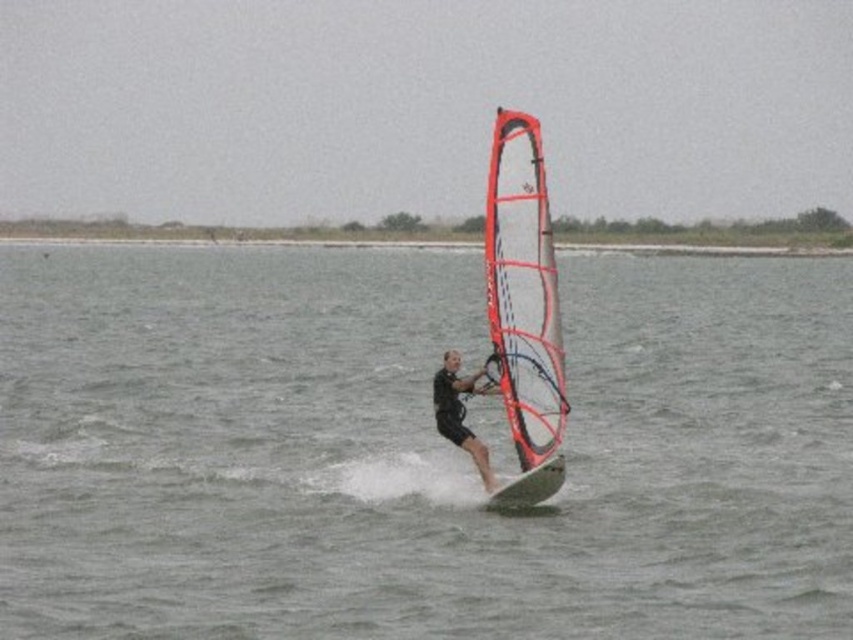
You are a photographer trying to capture the windsurfer. You notice the clear water at center and the transparent fabric sail at center in your viewfinder. Which object appears wider in the frame?

The clear water at center appears wider in the frame than the transparent fabric sail at center because its width is larger.

You are standing on a dock and see a point in the distance that is part of a windsurfing scene. The point has coordinates point (849, 600). You need to reach that point to retrieve an item. Given that your maximum reach is 10 meters, can you safely reach it without entering the water?

The point (849, 600) is 15.07 meters away from the viewer. Since your maximum reach is 10 meters, you cannot safely reach it without entering the water.